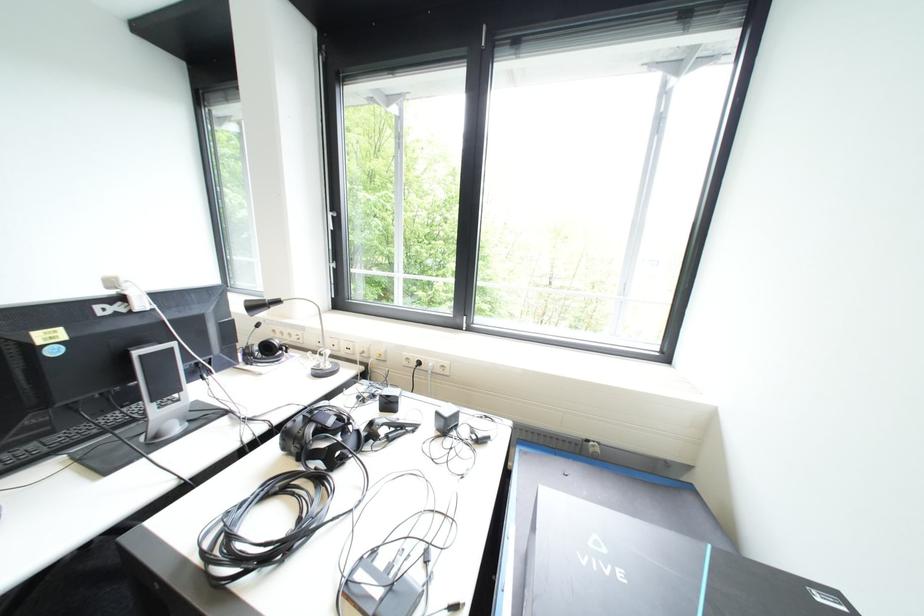
Where is `lamp switch`? The width and height of the screenshot is (924, 616). lamp switch is located at coordinates (440, 367).